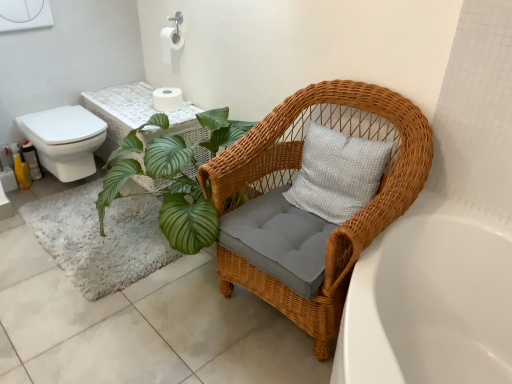
Question: Considering the relative sizes of white glossy toilet at left and white matte toilet paper at upper center, the 1th toilet paper positioned from the bottom, in the image provided, is white glossy toilet at left shorter than white matte toilet paper at upper center, the 1th toilet paper positioned from the bottom,?

Choices:
 (A) no
 (B) yes

Answer: (A)

Question: Considering the relative sizes of white glossy toilet at left and white matte toilet paper at upper center, which is the second toilet paper in top-to-bottom order, in the image provided, is white glossy toilet at left smaller than white matte toilet paper at upper center, which is the second toilet paper in top-to-bottom order,?

Choices:
 (A) no
 (B) yes

Answer: (A)

Question: Does white glossy toilet at left have a larger size compared to white matte toilet paper at upper center, which is the second toilet paper in top-to-bottom order?

Choices:
 (A) yes
 (B) no

Answer: (A)

Question: From the image's perspective, is white glossy toilet at left below white matte toilet paper at upper center, which is the second toilet paper in top-to-bottom order?

Choices:
 (A) yes
 (B) no

Answer: (A)

Question: From a real-world perspective, is white glossy toilet at left positioned over white matte toilet paper at upper center, which is the second toilet paper in top-to-bottom order, based on gravity?

Choices:
 (A) no
 (B) yes

Answer: (A)

Question: Can you confirm if white glossy toilet at left is wider than white matte toilet paper at upper center, which is the second toilet paper in top-to-bottom order?

Choices:
 (A) yes
 (B) no

Answer: (A)

Question: From the image's perspective, is white matte toilet paper at upper center, which is the second toilet paper in top-to-bottom order, above white ceramic bathtub at lower right?

Choices:
 (A) no
 (B) yes

Answer: (B)

Question: Is white matte toilet paper at upper center, which is the second toilet paper in top-to-bottom order, facing away from white ceramic bathtub at lower right?

Choices:
 (A) yes
 (B) no

Answer: (B)

Question: Can we say white matte toilet paper at upper center, the 1th toilet paper positioned from the bottom, lies outside white ceramic bathtub at lower right?

Choices:
 (A) yes
 (B) no

Answer: (A)

Question: From a real-world perspective, is white matte toilet paper at upper center, the 1th toilet paper positioned from the bottom, beneath white ceramic bathtub at lower right?

Choices:
 (A) no
 (B) yes

Answer: (A)

Question: Is white matte toilet paper at upper center, which is the second toilet paper in top-to-bottom order, not near white ceramic bathtub at lower right?

Choices:
 (A) yes
 (B) no

Answer: (A)

Question: Does white matte toilet paper at upper center, which is the second toilet paper in top-to-bottom order, have a lesser height compared to white ceramic bathtub at lower right?

Choices:
 (A) yes
 (B) no

Answer: (A)

Question: Is white matte toilet paper at upper center, the 1th toilet paper positioned from the bottom, shorter than white glossy toilet at left?

Choices:
 (A) no
 (B) yes

Answer: (B)